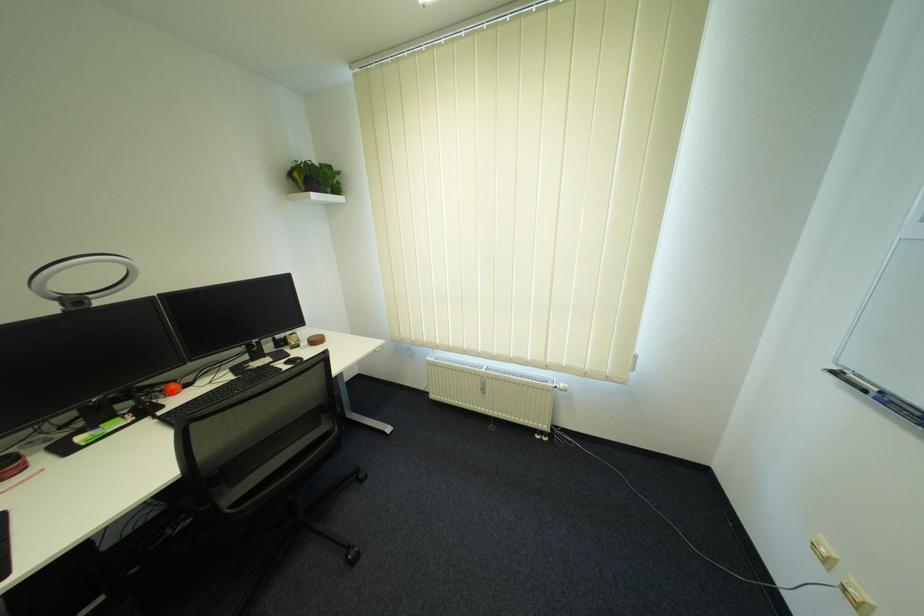
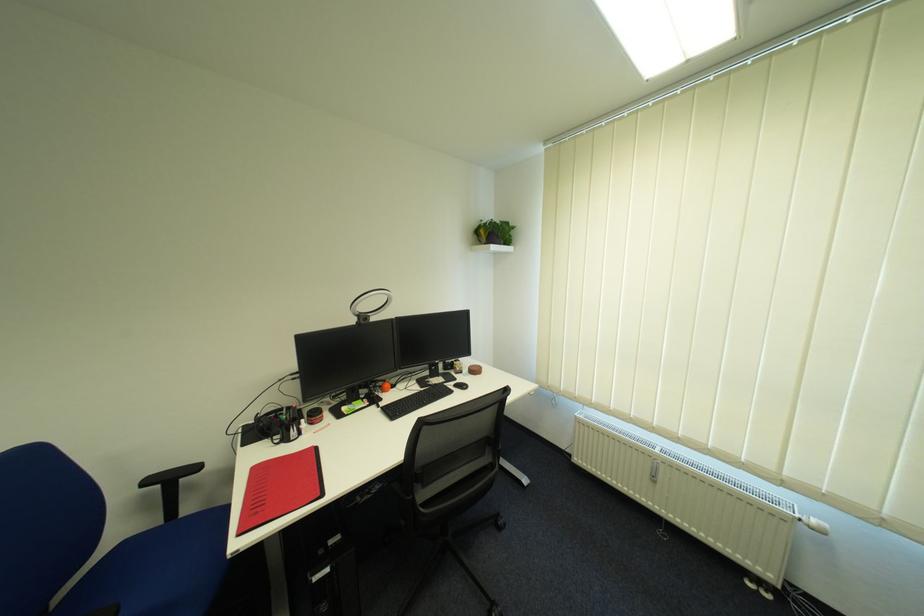
Locate, in the second image, the point that corresponds to the highlighted location in the first image.

(390, 387)